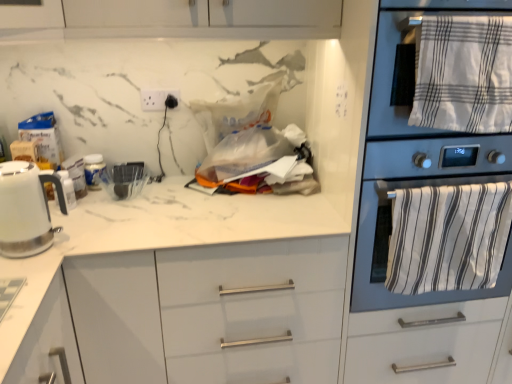
Identify the location of vacant point above white striped towel at right, which is counted as the first bath towel, starting from the bottom (from a real-world perspective). (443, 173).